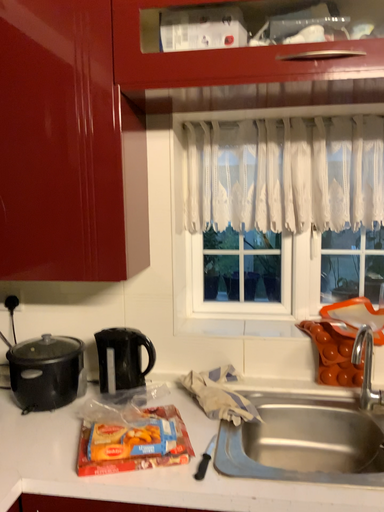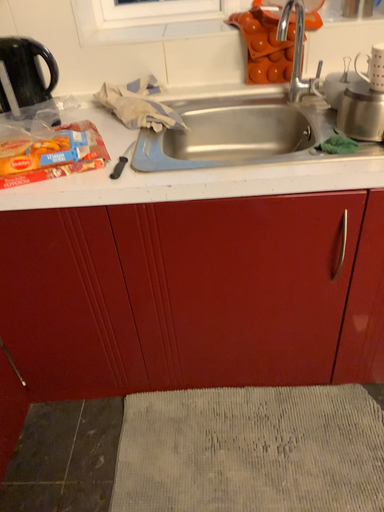
Question: Which way did the camera rotate in the video?

Choices:
 (A) rotated right
 (B) rotated left

Answer: (A)